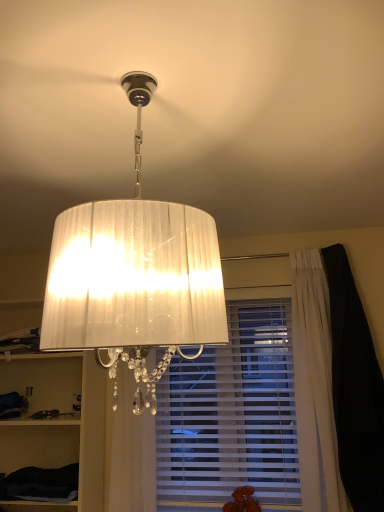
Question: From a real-world perspective, does white pleated curtain at lower center sit lower than white pleated fabric lampshade at upper center?

Choices:
 (A) yes
 (B) no

Answer: (A)

Question: From a real-world perspective, is white pleated curtain at lower center positioned over white pleated fabric lampshade at upper center based on gravity?

Choices:
 (A) yes
 (B) no

Answer: (B)

Question: Is white pleated fabric lampshade at upper center at the back of white pleated curtain at lower center?

Choices:
 (A) no
 (B) yes

Answer: (A)

Question: Is white pleated curtain at lower center positioned far away from white pleated fabric lampshade at upper center?

Choices:
 (A) yes
 (B) no

Answer: (A)

Question: Is white pleated curtain at lower center taller than white pleated fabric lampshade at upper center?

Choices:
 (A) no
 (B) yes

Answer: (B)

Question: Is white pleated curtain at lower center positioned in front of white pleated fabric lampshade at upper center?

Choices:
 (A) no
 (B) yes

Answer: (A)

Question: Considering the relative sizes of white sheer curtain at center and white fabric cabinet at left, which ranks as the 2th cabinet in bottom-to-top order, in the image provided, is white sheer curtain at center thinner than white fabric cabinet at left, which ranks as the 2th cabinet in bottom-to-top order,?

Choices:
 (A) no
 (B) yes

Answer: (A)

Question: Considering the relative sizes of white sheer curtain at center and white fabric cabinet at left, the first cabinet when ordered from top to bottom, in the image provided, is white sheer curtain at center taller than white fabric cabinet at left, the first cabinet when ordered from top to bottom,?

Choices:
 (A) no
 (B) yes

Answer: (A)

Question: From the image's perspective, does white sheer curtain at center appear lower than white fabric cabinet at left, which ranks as the 2th cabinet in bottom-to-top order?

Choices:
 (A) yes
 (B) no

Answer: (A)

Question: Considering the relative positions of white sheer curtain at center and white fabric cabinet at left, the first cabinet when ordered from top to bottom, in the image provided, is white sheer curtain at center to the left of white fabric cabinet at left, the first cabinet when ordered from top to bottom, from the viewer's perspective?

Choices:
 (A) no
 (B) yes

Answer: (A)

Question: Are white sheer curtain at center and white fabric cabinet at left, the first cabinet when ordered from top to bottom, located far from each other?

Choices:
 (A) no
 (B) yes

Answer: (A)

Question: Is white sheer curtain at center beside white fabric cabinet at left, the first cabinet when ordered from top to bottom?

Choices:
 (A) yes
 (B) no

Answer: (B)

Question: Is white fabric cabinet at left, the first cabinet when ordered from top to bottom, not inside white pleated fabric lampshade at upper center?

Choices:
 (A) no
 (B) yes

Answer: (B)